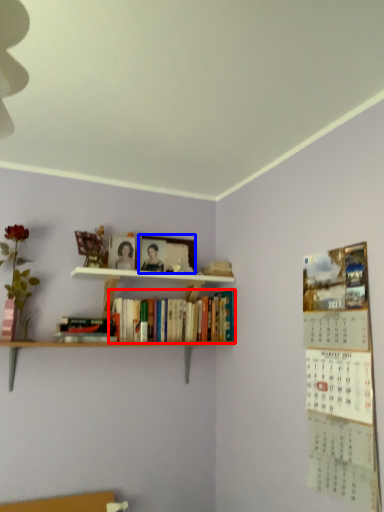
Question: Among these objects, which one is farthest to the camera, book (highlighted by a red box) or picture frame (highlighted by a blue box)?

Choices:
 (A) book
 (B) picture frame

Answer: (B)